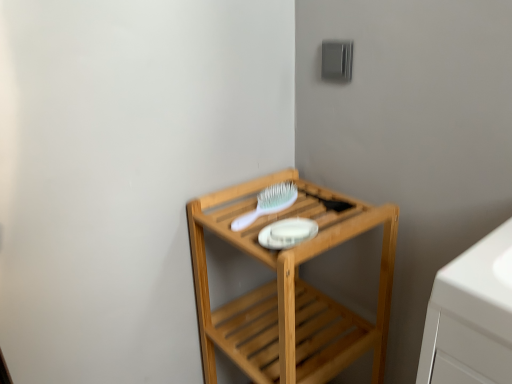
Locate an element on the screen. natural wood shelf at center is located at coordinates (289, 289).

Describe the element at coordinates (289, 289) in the screenshot. I see `natural wood shelf at center` at that location.

Measure the distance between white plastic brush at upper center and camera.

The distance of white plastic brush at upper center from camera is 87.10 centimeters.

In order to face white plastic brush at upper center, should I rotate leftwards or rightwards?

Turn right approximately 0.705 degrees to face it.

Find the location of a particular element. The width and height of the screenshot is (512, 384). white plastic brush at upper center is located at coordinates (268, 204).

Measure the distance between point (x=271, y=195) and camera.

A distance of 1.00 meters exists between point (x=271, y=195) and camera.

What do you see at coordinates (268, 204) in the screenshot? I see `white plastic brush at upper center` at bounding box center [268, 204].

Image resolution: width=512 pixels, height=384 pixels. I want to click on natural wood shelf at center, so click(x=289, y=289).

Which is more to the left, white plastic brush at upper center or natural wood shelf at center?

white plastic brush at upper center.

Is the depth of white plastic brush at upper center less than that of natural wood shelf at center?

No.

Is point (279, 184) farther from viewer compared to point (336, 322)?

No, (279, 184) is closer to viewer.

From the image's perspective, would you say white plastic brush at upper center is shown under natural wood shelf at center?

Actually, white plastic brush at upper center appears above natural wood shelf at center in the image.

From a real-world perspective, which is physically below, white plastic brush at upper center or natural wood shelf at center?

natural wood shelf at center is physically lower.

Looking at their sizes, would you say white plastic brush at upper center is wider or thinner than natural wood shelf at center?

Clearly, white plastic brush at upper center has less width compared to natural wood shelf at center.

Is white plastic brush at upper center taller or shorter than natural wood shelf at center?

white plastic brush at upper center is shorter than natural wood shelf at center.

Between white plastic brush at upper center and natural wood shelf at center, which one has larger size?

Bigger between the two is natural wood shelf at center.

Is natural wood shelf at center a part of white plastic brush at upper center?

Definitely not — natural wood shelf at center is not inside white plastic brush at upper center.

Is white plastic brush at upper center beside natural wood shelf at center?

white plastic brush at upper center is not next to natural wood shelf at center, and they're not touching.

Is white plastic brush at upper center positioned with its back to natural wood shelf at center?

Absolutely, white plastic brush at upper center is directed away from natural wood shelf at center.

How different are the orientations of white plastic brush at upper center and natural wood shelf at center in degrees?

There is a 5.11-degree angle between the facing directions of white plastic brush at upper center and natural wood shelf at center.

Image resolution: width=512 pixels, height=384 pixels. In order to click on furniture that is in front of the white plastic brush at upper center in this screenshot , I will do `click(289, 289)`.

Between natural wood shelf at center and white plastic brush at upper center, which one appears on the left side from the viewer's perspective?

white plastic brush at upper center.

In the image, is natural wood shelf at center positioned in front of or behind white plastic brush at upper center?

natural wood shelf at center is in front of white plastic brush at upper center.

Between point (380, 339) and point (275, 198), which one is positioned in front?

The point (275, 198) is closer to the camera.

From the image's perspective, who appears lower, natural wood shelf at center or white plastic brush at upper center?

natural wood shelf at center appears lower in the image.

From a real-world perspective, which object stands above the other?

white plastic brush at upper center.

Does natural wood shelf at center have a lesser width compared to white plastic brush at upper center?

In fact, natural wood shelf at center might be wider than white plastic brush at upper center.

Considering the sizes of natural wood shelf at center and white plastic brush at upper center in the image, is natural wood shelf at center taller or shorter than white plastic brush at upper center?

Clearly, natural wood shelf at center is taller compared to white plastic brush at upper center.

Which of these two, natural wood shelf at center or white plastic brush at upper center, is smaller?

white plastic brush at upper center.

Is natural wood shelf at center not within white plastic brush at upper center?

natural wood shelf at center lies outside white plastic brush at upper center's area.

Are natural wood shelf at center and white plastic brush at upper center making contact?

natural wood shelf at center and white plastic brush at upper center are not in contact.

Is natural wood shelf at center turned away from white plastic brush at upper center?

natural wood shelf at center does not have its back to white plastic brush at upper center.

How much distance is there between natural wood shelf at center and white plastic brush at upper center?

natural wood shelf at center is 8.48 inches from white plastic brush at upper center.

At what (x,y) coordinates should I click in order to perform the action: click on brush on the left of natural wood shelf at center. Please return your answer as a coordinate pair (x, y). Looking at the image, I should click on (268, 204).

This screenshot has width=512, height=384. Find the location of `furniture that is under the white plastic brush at upper center (from a real-world perspective)`. furniture that is under the white plastic brush at upper center (from a real-world perspective) is located at coordinates click(289, 289).

I want to click on furniture on the right of the white plastic brush at upper center, so click(x=289, y=289).